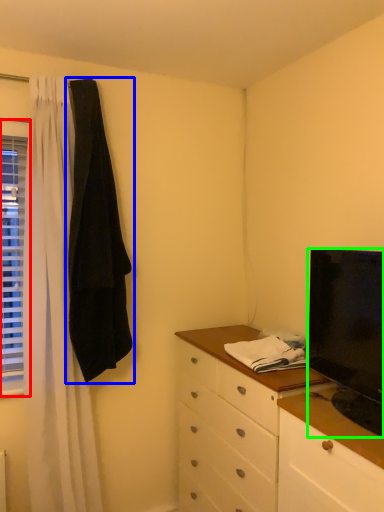
Question: Estimate the real-world distances between objects in this image. Which object is closer to window (highlighted by a red box), robe (highlighted by a blue box) or television (highlighted by a green box)?

Choices:
 (A) robe
 (B) television

Answer: (A)